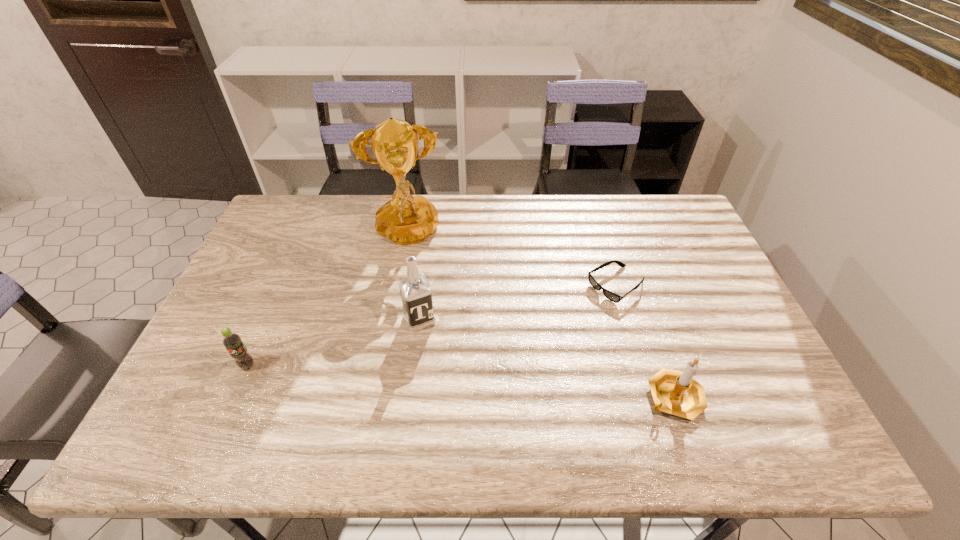
Identify the location of vacant space located on the front side of the tallest object. (424, 357).

Locate an element on the screen. The width and height of the screenshot is (960, 540). free space located 0.400m on the front side of the tallest object is located at coordinates (426, 370).

The height and width of the screenshot is (540, 960). Identify the location of free location located 0.180m on the front side of the tallest object. click(416, 306).

You are a GUI agent. You are given a task and a screenshot of the screen. Output one action in this format:
    pyautogui.click(x=<x>, y=<y>)
    Task: Click on the blank space located on the front label of the vodka
    This screenshot has height=540, width=960.
    Given the screenshot: What is the action you would take?
    pyautogui.click(x=447, y=378)

At what (x,y) coordinates should I click in order to perform the action: click on vacant area located 0.210m on the front label of the vodka. Please return your answer as a coordinate pair (x, y). Image resolution: width=960 pixels, height=540 pixels. Looking at the image, I should click on (455, 395).

At what (x,y) coordinates should I click in order to perform the action: click on vacant space located 0.160m on the front label of the vodka. Please return your answer as a coordinate pair (x, y). The image size is (960, 540). Looking at the image, I should click on (447, 378).

This screenshot has height=540, width=960. In order to click on object that is at the far edge in this screenshot , I will do `click(406, 219)`.

Where is `object present at the near edge`? This screenshot has height=540, width=960. object present at the near edge is located at coordinates (675, 392).

In order to click on object present at the left edge in this screenshot , I will do `click(231, 341)`.

The image size is (960, 540). I want to click on vacant point at the far edge, so click(x=578, y=201).